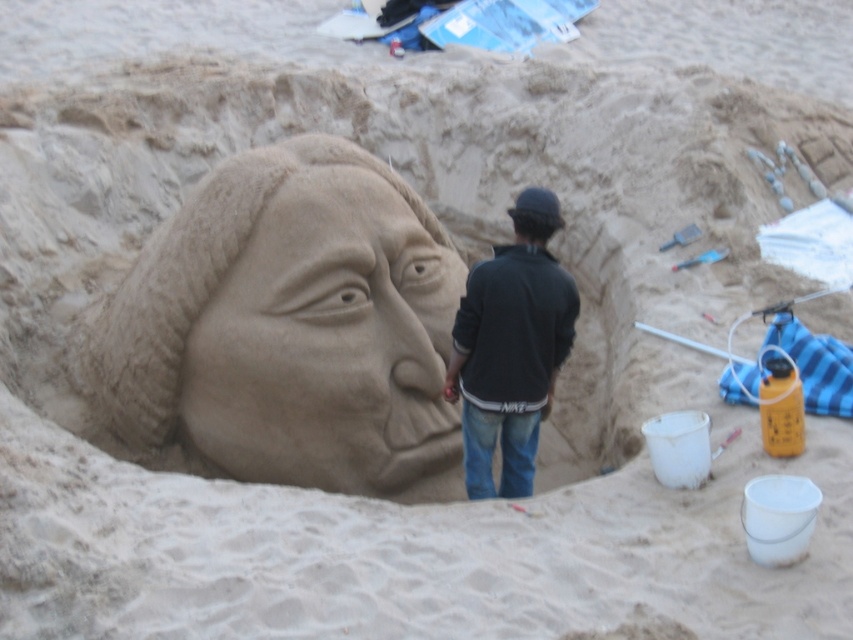
Question: Among these points, which one is farthest from the camera?

Choices:
 (A) (265, 227)
 (B) (532, 220)
 (C) (476, 340)

Answer: (A)

Question: Estimate the real-world distances between objects in this image. Which object is closer to the smooth sand sculpture at center?

Choices:
 (A) matte brown sand sculpture at center
 (B) black cotton jacket at center

Answer: (B)

Question: Is black cotton jacket at center to the right of matte brown sand sculpture at center from the viewer's perspective?

Choices:
 (A) no
 (B) yes

Answer: (A)

Question: In this image, where is smooth sand sculpture at center located relative to black cotton jacket at center?

Choices:
 (A) left
 (B) right

Answer: (A)

Question: Estimate the real-world distances between objects in this image. Which object is closer to the matte brown sand sculpture at center?

Choices:
 (A) black cotton jacket at center
 (B) smooth sand sculpture at center

Answer: (A)

Question: Is smooth sand sculpture at center positioned before matte brown sand sculpture at center?

Choices:
 (A) no
 (B) yes

Answer: (A)